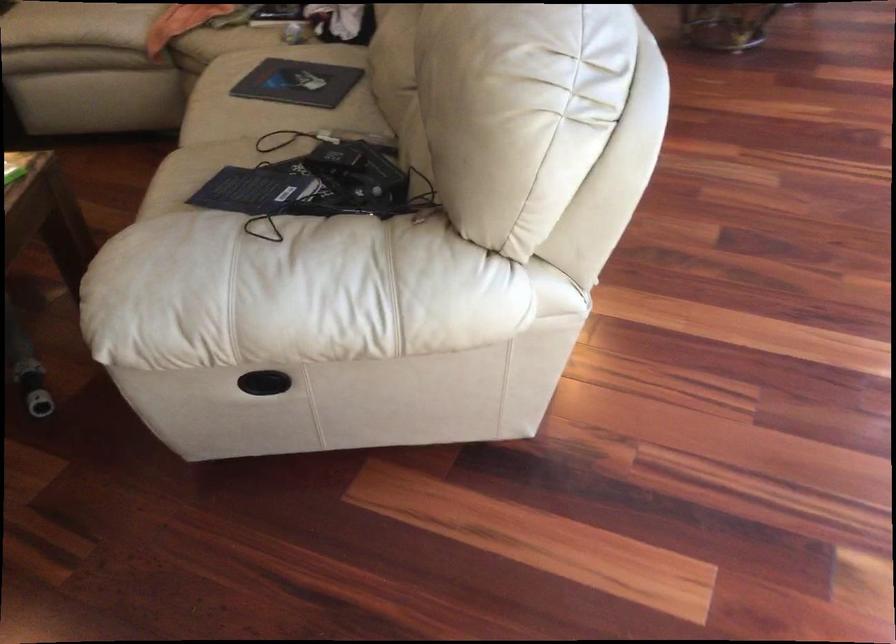
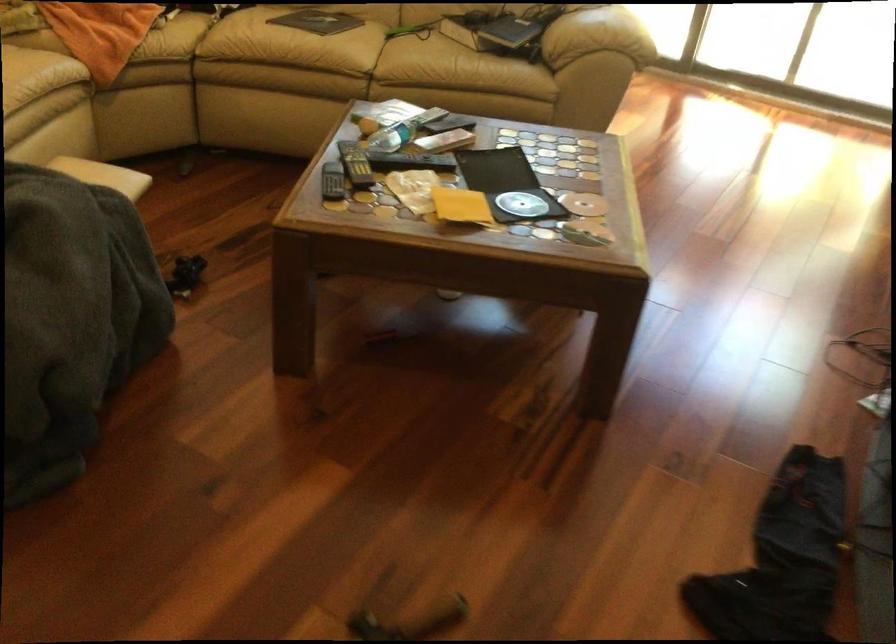
In the second image, find the point that corresponds to point (199, 115) in the first image.

(334, 58)